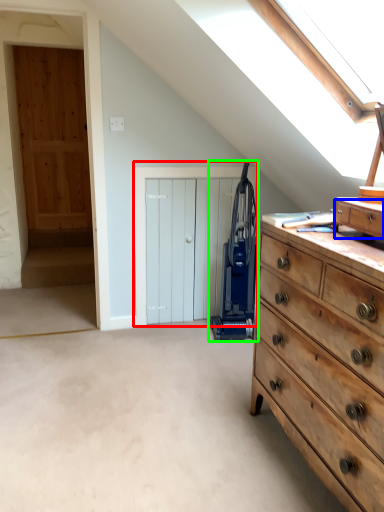
Question: Which is farther away from door (highlighted by a red box)? drawer (highlighted by a blue box) or appliance (highlighted by a green box)?

Choices:
 (A) drawer
 (B) appliance

Answer: (A)